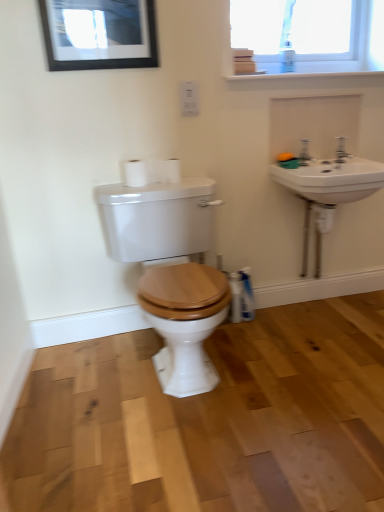
Locate an element on the screen. This screenshot has width=384, height=512. free location to the right of white plastic bottle at lower right is located at coordinates (279, 320).